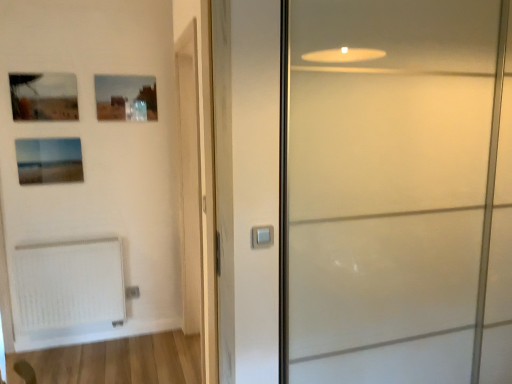
Question: From the image's perspective, does matte glass picture frame at upper left, the second picture frame from the bottom, appear lower than matte glass picture frame at upper center, acting as the 1th picture frame starting from the top?

Choices:
 (A) yes
 (B) no

Answer: (A)

Question: Is matte glass picture frame at upper left, the second picture frame in the top-to-bottom sequence, turned away from matte glass picture frame at upper center, which is the third picture frame from bottom to top?

Choices:
 (A) no
 (B) yes

Answer: (A)

Question: Could you tell me if matte glass picture frame at upper left, the second picture frame from the bottom, is facing matte glass picture frame at upper center, acting as the 1th picture frame starting from the top?

Choices:
 (A) yes
 (B) no

Answer: (B)

Question: Is matte glass picture frame at upper left, the second picture frame from the bottom, not close to matte glass picture frame at upper center, which is the third picture frame from bottom to top?

Choices:
 (A) yes
 (B) no

Answer: (B)

Question: Can you see matte glass picture frame at upper left, the second picture frame in the top-to-bottom sequence, touching matte glass picture frame at upper center, which is the third picture frame from bottom to top?

Choices:
 (A) no
 (B) yes

Answer: (A)

Question: Can you confirm if matte glass picture frame at upper left, the second picture frame from the bottom, is bigger than matte glass picture frame at upper center, acting as the 1th picture frame starting from the top?

Choices:
 (A) no
 (B) yes

Answer: (B)

Question: Does white textured radiator at lower left have a greater height compared to matte glass picture frame at upper left, which appears as the 1th picture frame when ordered from the bottom?

Choices:
 (A) yes
 (B) no

Answer: (A)

Question: Can you confirm if white textured radiator at lower left is bigger than matte glass picture frame at upper left, arranged as the 3th picture frame when viewed from the top?

Choices:
 (A) no
 (B) yes

Answer: (B)

Question: Is white textured radiator at lower left not inside matte glass picture frame at upper left, which appears as the 1th picture frame when ordered from the bottom?

Choices:
 (A) no
 (B) yes

Answer: (B)

Question: Can you confirm if white textured radiator at lower left is wider than matte glass picture frame at upper left, arranged as the 3th picture frame when viewed from the top?

Choices:
 (A) no
 (B) yes

Answer: (B)

Question: Would you say matte glass picture frame at upper left, which appears as the 1th picture frame when ordered from the bottom, is part of white textured radiator at lower left's contents?

Choices:
 (A) no
 (B) yes

Answer: (A)

Question: From a real-world perspective, is white textured radiator at lower left located higher than matte glass picture frame at upper left, which appears as the 1th picture frame when ordered from the bottom?

Choices:
 (A) no
 (B) yes

Answer: (A)

Question: Is matte glass picture frame at upper left, the second picture frame from the bottom, located within satin silver switch at center?

Choices:
 (A) yes
 (B) no

Answer: (B)